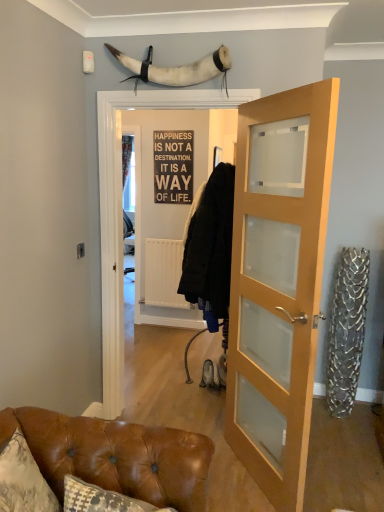
In order to face brown leather couch at lower left, should I rotate leftwards or rightwards?

To align with it, rotate left about 10.368°.

In order to click on brown leather couch at lower left in this screenshot , I will do `click(115, 456)`.

Locate an element on the screen. Image resolution: width=384 pixels, height=512 pixels. metallic sign at center is located at coordinates (173, 167).

Find the location of a particular element. The image size is (384, 512). brown leather couch at lower left is located at coordinates click(x=115, y=456).

Which of these two, light wood/glass door at center or metallic sign at center, is thinner?

Thinner between the two is metallic sign at center.

Looking at this image, is light wood/glass door at center aimed at metallic sign at center?

No, light wood/glass door at center does not turn towards metallic sign at center.

From the image's perspective, is light wood/glass door at center on metallic sign at center?

No.

Is light wood/glass door at center in front of or behind metallic sign at center in the image?

Clearly, light wood/glass door at center is in front of metallic sign at center.

From a real-world perspective, relative to light wood/glass door at center, is brown leather couch at lower left vertically above or below?

From a real-world perspective, brown leather couch at lower left is physically below light wood/glass door at center.

Based on their positions, is brown leather couch at lower left located to the left or right of light wood/glass door at center?

Clearly, brown leather couch at lower left is on the left of light wood/glass door at center in the image.

Looking at this image, between brown leather couch at lower left and light wood/glass door at center, which one has smaller size?

With smaller size is brown leather couch at lower left.

Would you consider metallic sign at center to be distant from brown leather couch at lower left?

Yes, metallic sign at center is far from brown leather couch at lower left.

Can brown leather couch at lower left be found inside metallic sign at center?

Definitely not — brown leather couch at lower left is not inside metallic sign at center.

How different are the orientations of metallic sign at center and brown leather couch at lower left in degrees?

The angular difference between metallic sign at center and brown leather couch at lower left is 0.836 degrees.

From the image's perspective, relative to brown leather couch at lower left, is metallic sign at center above or below?

metallic sign at center is situated higher than brown leather couch at lower left in the image.

Is light wood/glass door at center aimed at brown leather couch at lower left?

No, light wood/glass door at center is not turned towards brown leather couch at lower left.

Is light wood/glass door at center in front of or behind brown leather couch at lower left in the image?

In the image, light wood/glass door at center appears behind brown leather couch at lower left.

From the image's perspective, which one is positioned higher, light wood/glass door at center or brown leather couch at lower left?

light wood/glass door at center, from the image's perspective.

Looking at this image, would you say light wood/glass door at center is a long distance from brown leather couch at lower left?

light wood/glass door at center is actually quite close to brown leather couch at lower left.

Is brown leather couch at lower left not inside metallic sign at center?

Yes, brown leather couch at lower left is outside of metallic sign at center.

Does brown leather couch at lower left touch metallic sign at center?

No.

From the picture: Which is closer, (43, 413) or (157, 155)?

Clearly, point (43, 413) is closer to the camera than point (157, 155).

From the picture: Is light wood/glass door at center facing away from white fur horn at upper center?

That's not correct — light wood/glass door at center is not looking away from white fur horn at upper center.

Which point is more forward, (236,337) or (152,73)?

Positioned in front is point (152,73).

How many degrees apart are the facing directions of light wood/glass door at center and white fur horn at upper center?

55.5 degrees separate the facing orientations of light wood/glass door at center and white fur horn at upper center.

Is light wood/glass door at center taller than white fur horn at upper center?

Yes, light wood/glass door at center is taller than white fur horn at upper center.

Which object is more forward, white fur horn at upper center or light wood/glass door at center?

light wood/glass door at center.

From a real-world perspective, which object rests below the other?

In real-world perspective, light wood/glass door at center is lower.

Can you confirm if white fur horn at upper center is shorter than light wood/glass door at center?

Correct, white fur horn at upper center is not as tall as light wood/glass door at center.

Considering the positions of point (165, 75) and point (277, 99), is point (165, 75) closer or farther from the camera than point (277, 99)?

Point (165, 75) is farther from the camera than point (277, 99).

Where is `writing behind the light wood/glass door at center`? writing behind the light wood/glass door at center is located at coordinates (173, 167).

Identify the location of door above the brown leather couch at lower left (from a real-world perspective). (278, 295).

From the image, which object appears to be farther from white fur horn at upper center, metallic sign at center or brown leather couch at lower left?

metallic sign at center lies further to white fur horn at upper center than the other object.

From the picture: Considering their positions, is light wood/glass door at center positioned further to metallic sign at center than brown leather couch at lower left?

Based on the image, brown leather couch at lower left appears to be further to metallic sign at center.

Which object lies nearer to the anchor point white fur horn at upper center, metallic sign at center or light wood/glass door at center?

light wood/glass door at center is positioned closer to the anchor white fur horn at upper center.

Considering their positions, is light wood/glass door at center positioned further to brown leather couch at lower left than white fur horn at upper center?

Based on the image, white fur horn at upper center appears to be further to brown leather couch at lower left.

When comparing their distances from light wood/glass door at center, does white fur horn at upper center or brown leather couch at lower left seem closer?

brown leather couch at lower left is positioned closer to the anchor light wood/glass door at center.

Based on their spatial positions, is white fur horn at upper center or light wood/glass door at center further from brown leather couch at lower left?

Based on the image, white fur horn at upper center appears to be further to brown leather couch at lower left.

Which object lies further to the anchor point metallic sign at center, brown leather couch at lower left or white fur horn at upper center?

brown leather couch at lower left.

Which object lies further to the anchor point metallic sign at center, light wood/glass door at center or white fur horn at upper center?

light wood/glass door at center.

Where is `animal between light wood/glass door at center and metallic sign at center in the front-back direction`? This screenshot has width=384, height=512. animal between light wood/glass door at center and metallic sign at center in the front-back direction is located at coordinates (176, 68).

Where is `door positioned between brown leather couch at lower left and metallic sign at center from near to far`? The height and width of the screenshot is (512, 384). door positioned between brown leather couch at lower left and metallic sign at center from near to far is located at coordinates (278, 295).

Locate an element on the screen. The image size is (384, 512). animal positioned between brown leather couch at lower left and metallic sign at center from near to far is located at coordinates (176, 68).

I want to click on door that lies between white fur horn at upper center and brown leather couch at lower left from top to bottom, so click(278, 295).